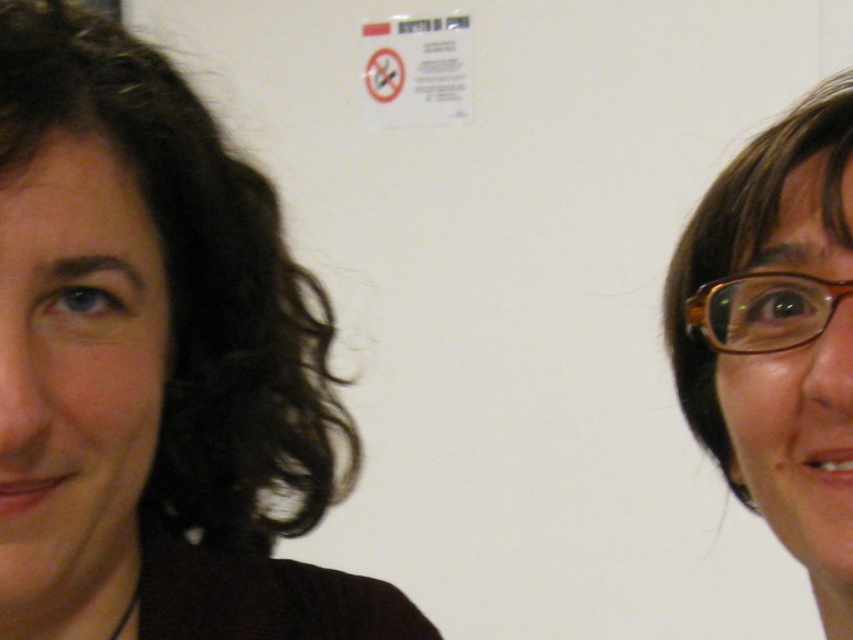
Who is positioned more to the right, brown matte glasses at right or brown plastic glasses at right?

brown matte glasses at right is more to the right.

How distant is brown matte glasses at right from brown plastic glasses at right?

They are 2.35 inches apart.

Is point (759, 422) behind point (788, 308)?

No, it is not.

This screenshot has width=853, height=640. I want to click on brown matte glasses at right, so click(x=776, y=336).

Between dark brown hair at left and brown plastic glasses at right, which one has more height?

Standing taller between the two is dark brown hair at left.

Between dark brown hair at left and brown plastic glasses at right, which one appears on the left side from the viewer's perspective?

dark brown hair at left

The image size is (853, 640). Describe the element at coordinates (154, 364) in the screenshot. I see `dark brown hair at left` at that location.

This screenshot has width=853, height=640. I want to click on dark brown hair at left, so click(154, 364).

Is dark brown hair at left taller than brown matte glasses at right?

Indeed, dark brown hair at left has a greater height compared to brown matte glasses at right.

Which is more to the right, dark brown hair at left or brown matte glasses at right?

Positioned to the right is brown matte glasses at right.

I want to click on dark brown hair at left, so coord(154,364).